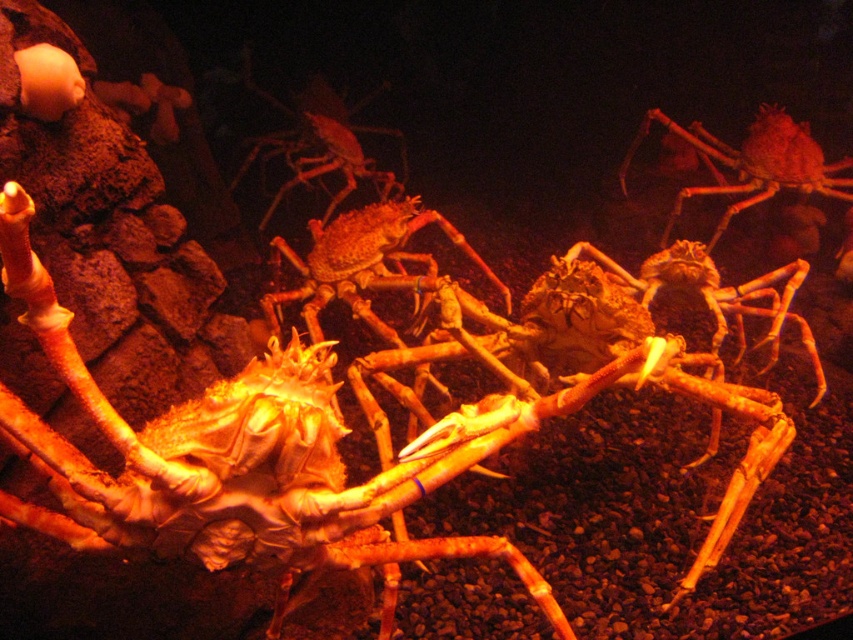
Based on the photo, which is below, smooth orange crab at center or smooth orange crab at upper right?

smooth orange crab at center is lower down.

How distant is smooth orange crab at center from smooth orange crab at upper right?

smooth orange crab at center and smooth orange crab at upper right are 3.30 meters apart.

Is point (57, 337) positioned before point (769, 157)?

Yes.

The image size is (853, 640). I want to click on smooth orange crab at center, so click(x=300, y=454).